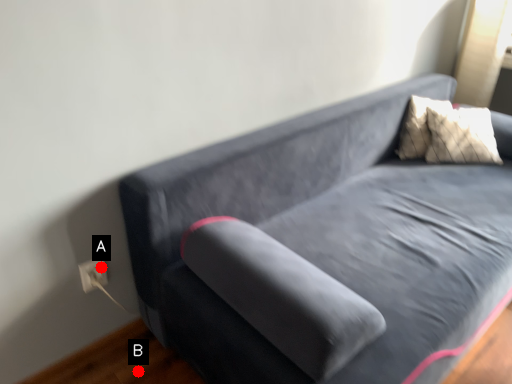
Question: Two points are circled on the image, labeled by A and B beside each circle. Which point is farther to the camera?

Choices:
 (A) A is further
 (B) B is further

Answer: (B)